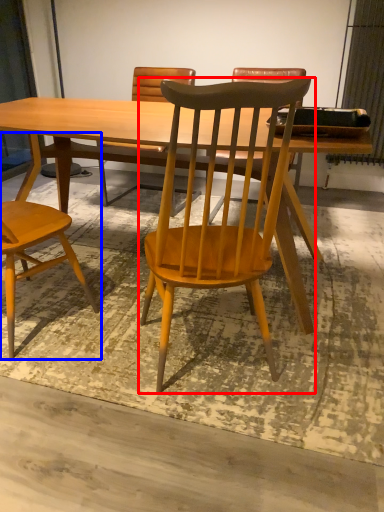
Question: Which object appears closest to the camera in this image, chair (highlighted by a red box) or chair (highlighted by a blue box)?

Choices:
 (A) chair
 (B) chair

Answer: (A)